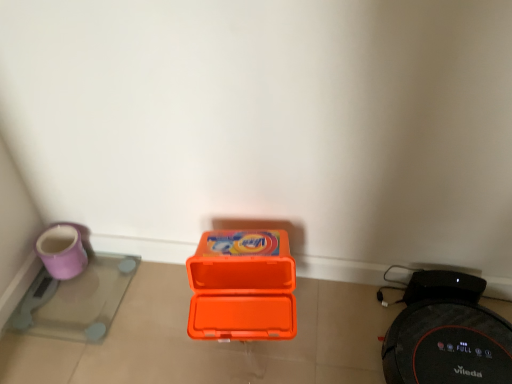
What is the approximate height of purple glossy scale at lower left, the second appliance when ordered from right to left?

purple glossy scale at lower left, the second appliance when ordered from right to left, is 1.11 inches in height.

What is the approximate height of black rubber robot vacuum cleaner at lower right, marked as the 1th appliance in a right-to-left arrangement?

black rubber robot vacuum cleaner at lower right, marked as the 1th appliance in a right-to-left arrangement, is 4.86 inches tall.

The height and width of the screenshot is (384, 512). What do you see at coordinates (447, 334) in the screenshot?
I see `black rubber robot vacuum cleaner at lower right, the second appliance in the left-to-right sequence` at bounding box center [447, 334].

This screenshot has height=384, width=512. Find the location of `orange plastic box at center`. orange plastic box at center is located at coordinates (242, 286).

From a real-world perspective, which object rests below the other?

From a 3D spatial view, black rubber robot vacuum cleaner at lower right, marked as the 1th appliance in a right-to-left arrangement, is below.

Does orange plastic box at center touch black rubber robot vacuum cleaner at lower right, marked as the 1th appliance in a right-to-left arrangement?

No, orange plastic box at center is not touching black rubber robot vacuum cleaner at lower right, marked as the 1th appliance in a right-to-left arrangement.

Looking at this image, which is closer to the camera, (222, 288) or (469, 277)?

Point (222, 288) is closer to the camera than point (469, 277).

Can black rubber robot vacuum cleaner at lower right, the second appliance in the left-to-right sequence, be found inside orange plastic box at center?

No, black rubber robot vacuum cleaner at lower right, the second appliance in the left-to-right sequence, is not surrounded by orange plastic box at center.

From the image's perspective, who appears lower, black rubber robot vacuum cleaner at lower right, marked as the 1th appliance in a right-to-left arrangement, or purple glossy scale at lower left, the first appliance viewed from the left?

From the image's view, black rubber robot vacuum cleaner at lower right, marked as the 1th appliance in a right-to-left arrangement, is below.

From the picture: How much distance is there between black rubber robot vacuum cleaner at lower right, the second appliance in the left-to-right sequence, and purple glossy scale at lower left, the second appliance when ordered from right to left?

33.59 inches.

Considering the relative positions of black rubber robot vacuum cleaner at lower right, marked as the 1th appliance in a right-to-left arrangement, and purple glossy scale at lower left, the second appliance when ordered from right to left, in the image provided, is black rubber robot vacuum cleaner at lower right, marked as the 1th appliance in a right-to-left arrangement, to the right of purple glossy scale at lower left, the second appliance when ordered from right to left, from the viewer's perspective?

Yes.

From a real-world perspective, which object rests below the other?

purple glossy scale at lower left, the second appliance when ordered from right to left, is physically lower.

Are orange plastic box at center and purple glossy scale at lower left, the first appliance viewed from the left, located far from each other?

No, orange plastic box at center is not far away from purple glossy scale at lower left, the first appliance viewed from the left.

In the scene shown: Is orange plastic box at center smaller than purple glossy scale at lower left, the second appliance when ordered from right to left?

Actually, orange plastic box at center might be larger than purple glossy scale at lower left, the second appliance when ordered from right to left.

Would you say purple glossy scale at lower left, the first appliance viewed from the left, is part of orange plastic box at center's contents?

No, purple glossy scale at lower left, the first appliance viewed from the left, is located outside of orange plastic box at center.

Based on the photo, from a real-world perspective, is orange plastic box at center positioned under purple glossy scale at lower left, the second appliance when ordered from right to left, based on gravity?

No, from a real-world perspective, orange plastic box at center is not beneath purple glossy scale at lower left, the second appliance when ordered from right to left.

Is purple glossy scale at lower left, the second appliance when ordered from right to left, not within orange plastic box at center?

purple glossy scale at lower left, the second appliance when ordered from right to left, is positioned outside orange plastic box at center.

Is purple glossy scale at lower left, the second appliance when ordered from right to left, facing away from orange plastic box at center?

No, purple glossy scale at lower left, the second appliance when ordered from right to left, is not facing away from orange plastic box at center.

How different are the orientations of purple glossy scale at lower left, the second appliance when ordered from right to left, and orange plastic box at center in degrees?

7.24 degrees separate the facing orientations of purple glossy scale at lower left, the second appliance when ordered from right to left, and orange plastic box at center.

Could you measure the distance between purple glossy scale at lower left, the second appliance when ordered from right to left, and orange plastic box at center?

purple glossy scale at lower left, the second appliance when ordered from right to left, and orange plastic box at center are 39.79 centimeters apart.

Is black rubber robot vacuum cleaner at lower right, marked as the 1th appliance in a right-to-left arrangement, inside or outside of orange plastic box at center?

black rubber robot vacuum cleaner at lower right, marked as the 1th appliance in a right-to-left arrangement, is not enclosed by orange plastic box at center.

Which of these two, black rubber robot vacuum cleaner at lower right, marked as the 1th appliance in a right-to-left arrangement, or orange plastic box at center, is wider?

Wider between the two is black rubber robot vacuum cleaner at lower right, marked as the 1th appliance in a right-to-left arrangement.

Between black rubber robot vacuum cleaner at lower right, the second appliance in the left-to-right sequence, and orange plastic box at center, which one appears on the left side from the viewer's perspective?

orange plastic box at center is more to the left.

Between black rubber robot vacuum cleaner at lower right, the second appliance in the left-to-right sequence, and orange plastic box at center, which one has less height?

black rubber robot vacuum cleaner at lower right, the second appliance in the left-to-right sequence.

Considering the relative positions of purple glossy scale at lower left, the first appliance viewed from the left, and black rubber robot vacuum cleaner at lower right, the second appliance in the left-to-right sequence, in the image provided, is purple glossy scale at lower left, the first appliance viewed from the left, to the left or to the right of black rubber robot vacuum cleaner at lower right, the second appliance in the left-to-right sequence,?

purple glossy scale at lower left, the first appliance viewed from the left, is positioned on black rubber robot vacuum cleaner at lower right, the second appliance in the left-to-right sequence,'s left side.

Between purple glossy scale at lower left, the second appliance when ordered from right to left, and black rubber robot vacuum cleaner at lower right, the second appliance in the left-to-right sequence, which one is positioned in front?

black rubber robot vacuum cleaner at lower right, the second appliance in the left-to-right sequence, is in front.

Where is `appliance located underneath the black rubber robot vacuum cleaner at lower right, marked as the 1th appliance in a right-to-left arrangement (from a real-world perspective)`? This screenshot has height=384, width=512. appliance located underneath the black rubber robot vacuum cleaner at lower right, marked as the 1th appliance in a right-to-left arrangement (from a real-world perspective) is located at coordinates (76, 297).

Locate an element on the screen. The width and height of the screenshot is (512, 384). box behind the black rubber robot vacuum cleaner at lower right, the second appliance in the left-to-right sequence is located at coordinates (242, 286).

Where is `appliance above the purple glossy scale at lower left, the first appliance viewed from the left (from a real-world perspective)`? Image resolution: width=512 pixels, height=384 pixels. appliance above the purple glossy scale at lower left, the first appliance viewed from the left (from a real-world perspective) is located at coordinates (447, 334).

When comparing their distances from orange plastic box at center, does black rubber robot vacuum cleaner at lower right, marked as the 1th appliance in a right-to-left arrangement, or purple glossy scale at lower left, the second appliance when ordered from right to left, seem further?

Among the two, purple glossy scale at lower left, the second appliance when ordered from right to left, is located further to orange plastic box at center.

Based on their spatial positions, is purple glossy scale at lower left, the second appliance when ordered from right to left, or black rubber robot vacuum cleaner at lower right, marked as the 1th appliance in a right-to-left arrangement, closer to orange plastic box at center?

Among the two, black rubber robot vacuum cleaner at lower right, marked as the 1th appliance in a right-to-left arrangement, is located nearer to orange plastic box at center.

Estimate the real-world distances between objects in this image. Which object is further from purple glossy scale at lower left, the first appliance viewed from the left, orange plastic box at center or black rubber robot vacuum cleaner at lower right, marked as the 1th appliance in a right-to-left arrangement?

Based on the image, black rubber robot vacuum cleaner at lower right, marked as the 1th appliance in a right-to-left arrangement, appears to be further to purple glossy scale at lower left, the first appliance viewed from the left.

Estimate the real-world distances between objects in this image. Which object is further from black rubber robot vacuum cleaner at lower right, marked as the 1th appliance in a right-to-left arrangement, orange plastic box at center or purple glossy scale at lower left, the second appliance when ordered from right to left?

purple glossy scale at lower left, the second appliance when ordered from right to left, lies further to black rubber robot vacuum cleaner at lower right, marked as the 1th appliance in a right-to-left arrangement, than the other object.

Looking at the image, which one is located closer to black rubber robot vacuum cleaner at lower right, the second appliance in the left-to-right sequence, purple glossy scale at lower left, the first appliance viewed from the left, or orange plastic box at center?

orange plastic box at center lies closer to black rubber robot vacuum cleaner at lower right, the second appliance in the left-to-right sequence, than the other object.

Considering their positions, is black rubber robot vacuum cleaner at lower right, the second appliance in the left-to-right sequence, positioned closer to purple glossy scale at lower left, the first appliance viewed from the left, than orange plastic box at center?

orange plastic box at center is closer to purple glossy scale at lower left, the first appliance viewed from the left.

Find the location of a particular element. box located between purple glossy scale at lower left, the first appliance viewed from the left, and black rubber robot vacuum cleaner at lower right, marked as the 1th appliance in a right-to-left arrangement, in the left-right direction is located at coordinates (242, 286).